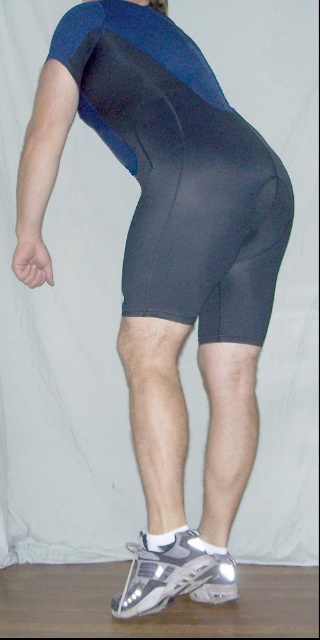
Can you confirm if black matte shorts at center is positioned to the right of matte gray shorts at lower center?

Yes, black matte shorts at center is to the right of matte gray shorts at lower center.

This screenshot has height=640, width=320. Find the location of `black matte shorts at center`. black matte shorts at center is located at coordinates (181, 172).

At what (x,y) coordinates should I click in order to perform the action: click on black matte shorts at center. Please return your answer as a coordinate pair (x, y). Looking at the image, I should click on (181, 172).